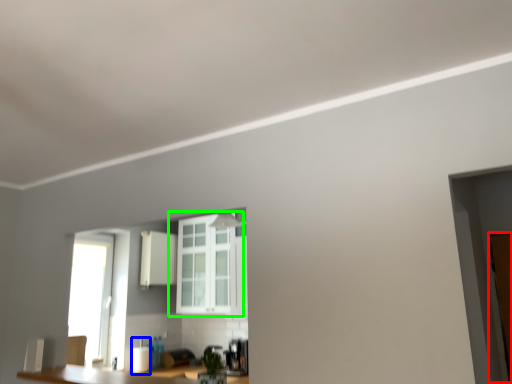
Question: Which is nearer to the door (highlighted by a red box)? appliance (highlighted by a blue box) or window (highlighted by a green box).

Choices:
 (A) appliance
 (B) window

Answer: (B)